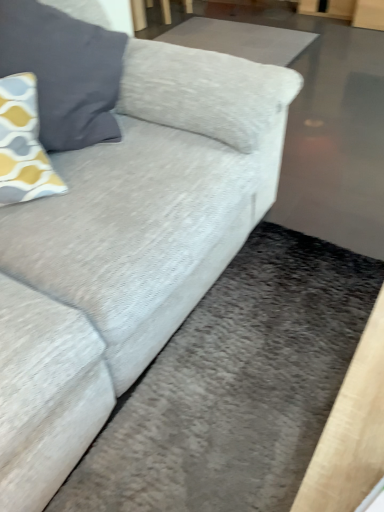
In order to face smooth gray flat at upper center, should I rotate leftwards or rightwards?

To align with it, rotate right about 5.575°.

This screenshot has width=384, height=512. What do you see at coordinates (240, 39) in the screenshot?
I see `smooth gray flat at upper center` at bounding box center [240, 39].

Where is `smooth gray flat at upper center`? Image resolution: width=384 pixels, height=512 pixels. smooth gray flat at upper center is located at coordinates (240, 39).

Identify the location of yellow-gray patterned pillow at upper left. (64, 71).

Image resolution: width=384 pixels, height=512 pixels. Describe the element at coordinates (64, 71) in the screenshot. I see `yellow-gray patterned pillow at upper left` at that location.

Where is `smooth gray flat at upper center`? The width and height of the screenshot is (384, 512). smooth gray flat at upper center is located at coordinates point(240,39).

Can you confirm if smooth gray flat at upper center is positioned to the left of yellow-gray patterned pillow at upper left?

No, smooth gray flat at upper center is not to the left of yellow-gray patterned pillow at upper left.

Is smooth gray flat at upper center positioned before yellow-gray patterned pillow at upper left?

No, smooth gray flat at upper center is further to the viewer.

Which is farther from the camera, (197, 32) or (8, 64)?

Positioned behind is point (197, 32).

From the image's perspective, is smooth gray flat at upper center below yellow-gray patterned pillow at upper left?

No.

From a real-world perspective, between smooth gray flat at upper center and yellow-gray patterned pillow at upper left, who is vertically lower?

smooth gray flat at upper center is physically lower.

Considering the sizes of objects smooth gray flat at upper center and yellow-gray patterned pillow at upper left in the image provided, who is thinner, smooth gray flat at upper center or yellow-gray patterned pillow at upper left?

yellow-gray patterned pillow at upper left.

Which of these two, smooth gray flat at upper center or yellow-gray patterned pillow at upper left, stands taller?

yellow-gray patterned pillow at upper left is taller.

Which of these two, smooth gray flat at upper center or yellow-gray patterned pillow at upper left, is bigger?

yellow-gray patterned pillow at upper left is bigger.

From the picture: Is smooth gray flat at upper center completely or partially outside of yellow-gray patterned pillow at upper left?

Absolutely, smooth gray flat at upper center is external to yellow-gray patterned pillow at upper left.

Is smooth gray flat at upper center placed right next to yellow-gray patterned pillow at upper left?

smooth gray flat at upper center is not next to yellow-gray patterned pillow at upper left, and they're not touching.

Is smooth gray flat at upper center looking in the opposite direction of yellow-gray patterned pillow at upper left?

smooth gray flat at upper center does not have its back to yellow-gray patterned pillow at upper left.

Find the location of a particular element. The width and height of the screenshot is (384, 512). pillow in front of the smooth gray flat at upper center is located at coordinates (64, 71).

Considering the positions of objects yellow-gray patterned pillow at upper left and smooth gray flat at upper center in the image provided, who is more to the right, yellow-gray patterned pillow at upper left or smooth gray flat at upper center?

smooth gray flat at upper center is more to the right.

Is yellow-gray patterned pillow at upper left further to the viewer compared to smooth gray flat at upper center?

No, it is in front of smooth gray flat at upper center.

Does point (23, 40) come closer to viewer compared to point (200, 32)?

Yes, point (23, 40) is in front of point (200, 32).

From the image's perspective, does yellow-gray patterned pillow at upper left appear lower than smooth gray flat at upper center?

Yes, from the image's perspective, yellow-gray patterned pillow at upper left is beneath smooth gray flat at upper center.

From a real-world perspective, does yellow-gray patterned pillow at upper left stand above smooth gray flat at upper center?

Yes, from a real-world perspective, yellow-gray patterned pillow at upper left is over smooth gray flat at upper center

Considering the relative sizes of yellow-gray patterned pillow at upper left and smooth gray flat at upper center in the image provided, is yellow-gray patterned pillow at upper left thinner than smooth gray flat at upper center?

Yes.

Considering the relative sizes of yellow-gray patterned pillow at upper left and smooth gray flat at upper center in the image provided, is yellow-gray patterned pillow at upper left shorter than smooth gray flat at upper center?

No.

Considering the sizes of yellow-gray patterned pillow at upper left and smooth gray flat at upper center in the image, is yellow-gray patterned pillow at upper left bigger or smaller than smooth gray flat at upper center?

yellow-gray patterned pillow at upper left is bigger than smooth gray flat at upper center.

Is smooth gray flat at upper center inside yellow-gray patterned pillow at upper left?

No, smooth gray flat at upper center is not inside yellow-gray patterned pillow at upper left.

Is yellow-gray patterned pillow at upper left in contact with smooth gray flat at upper center?

yellow-gray patterned pillow at upper left and smooth gray flat at upper center are clearly separated.

Is yellow-gray patterned pillow at upper left oriented towards smooth gray flat at upper center?

No, yellow-gray patterned pillow at upper left is not facing towards smooth gray flat at upper center.

How far apart are yellow-gray patterned pillow at upper left and smooth gray flat at upper center?

A distance of 6.20 feet exists between yellow-gray patterned pillow at upper left and smooth gray flat at upper center.

In order to click on flat that is behind the yellow-gray patterned pillow at upper left in this screenshot , I will do `click(240, 39)`.

You are a GUI agent. You are given a task and a screenshot of the screen. Output one action in this format:
    pyautogui.click(x=<x>, y=<y>)
    Task: Click on the pillow in front of the smooth gray flat at upper center
    Image resolution: width=384 pixels, height=512 pixels.
    Given the screenshot: What is the action you would take?
    pyautogui.click(x=64, y=71)

Identify the location of flat above the yellow-gray patterned pillow at upper left (from the image's perspective). (240, 39).